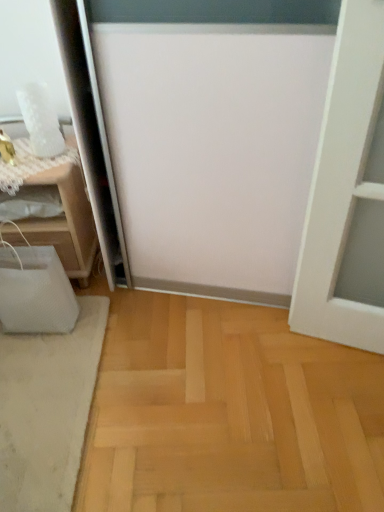
This screenshot has width=384, height=512. I want to click on vacant space underneath white soft rug at lower left (from a real-world perspective), so click(43, 390).